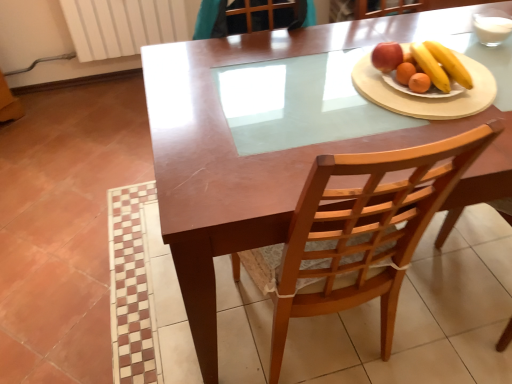
Where is `free area behind smooth wooden plate with fruits at right`? free area behind smooth wooden plate with fruits at right is located at coordinates (386, 42).